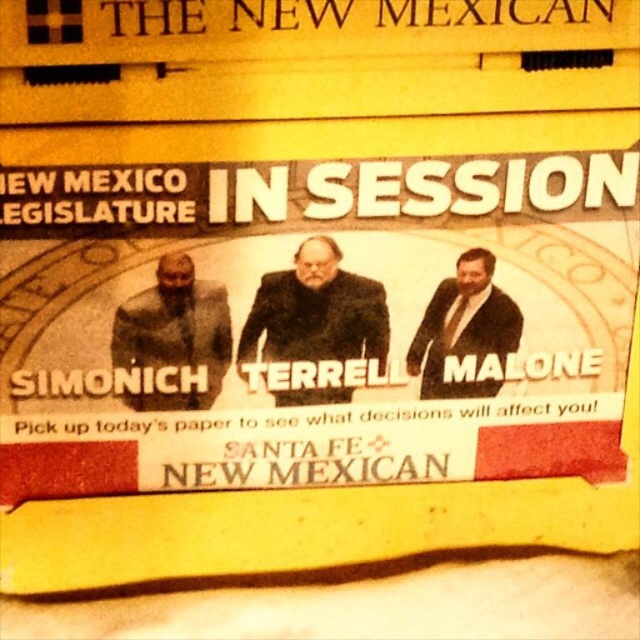
You are a fashion designer observing the advertisement in THE NEW MEXICAN. You notice the dark brown suit at center and the matte black suit at right. Which suit is closer to the front of the image?

The dark brown suit at center is in front of the matte black suit at right, so it is closer to the front of the image.

You are a fashion designer analyzing the advertisement in THE NEW MEXICAN. You notice two suits in the image. Which one, the dark brown suit at center or the matte black suit at center, appears larger in height?

The dark brown suit at center is much taller than the matte black suit at center.